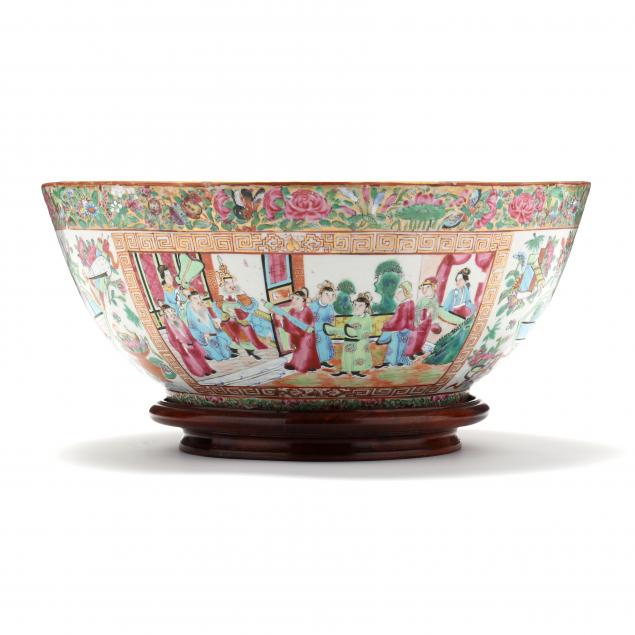
I want to click on table, so click(345, 550).